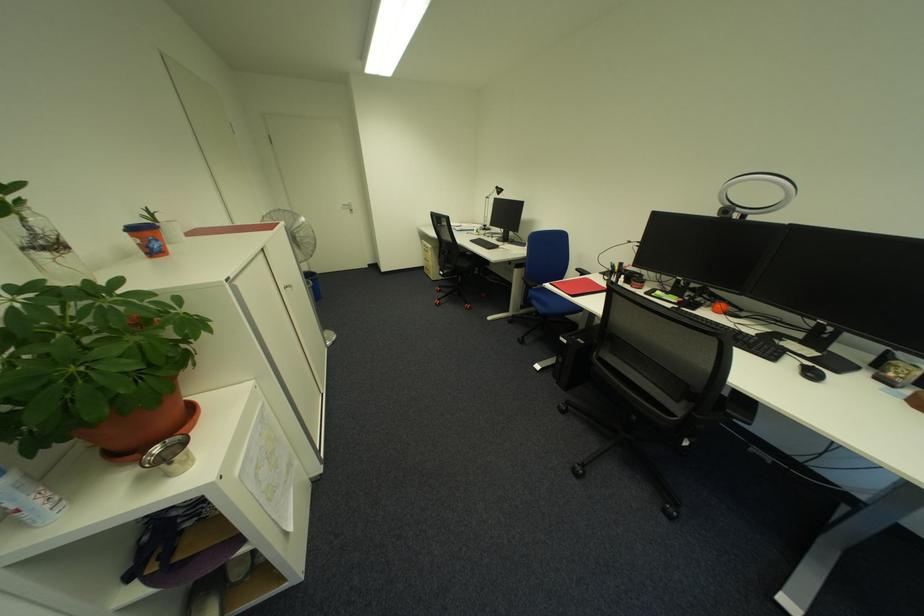
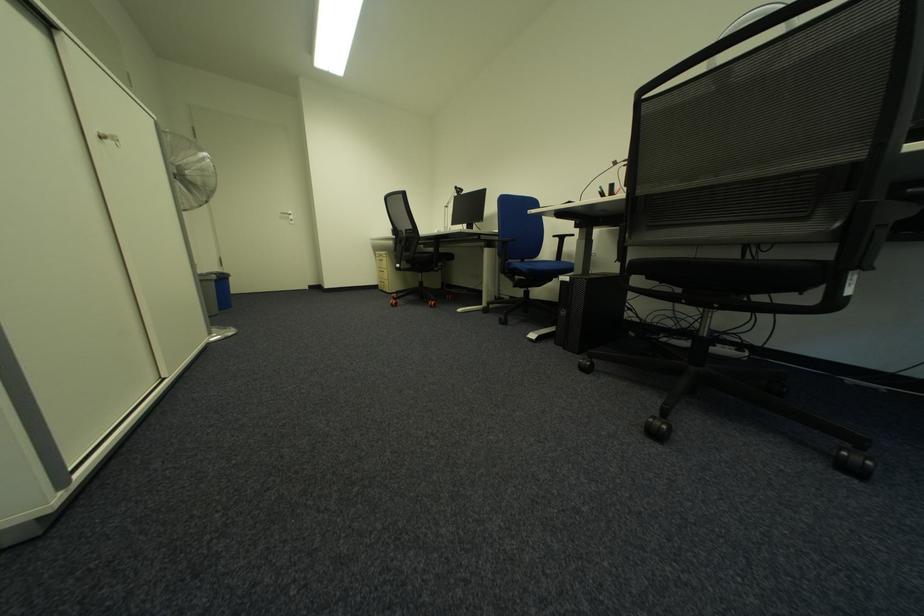
Question: What movement of the cameraman would produce the second image?

Choices:
 (A) Left
 (B) Right
 (C) Forward
 (D) Backward

Answer: (C)